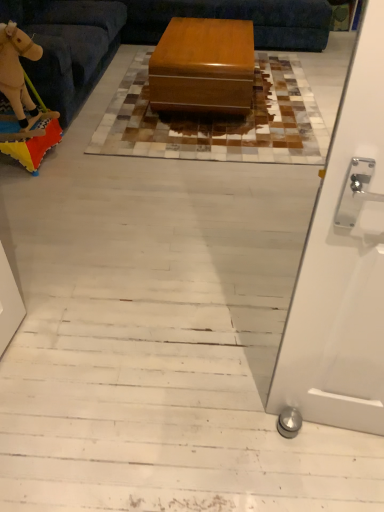
Question: Is velvety beige rocking horse at left to the right of wooden toy horse at left from the viewer's perspective?

Choices:
 (A) yes
 (B) no

Answer: (A)

Question: Is wooden toy horse at left at the back of velvety beige rocking horse at left?

Choices:
 (A) no
 (B) yes

Answer: (A)

Question: Does velvety beige rocking horse at left appear on the left side of wooden toy horse at left?

Choices:
 (A) yes
 (B) no

Answer: (B)

Question: Is velvety beige rocking horse at left thinner than wooden toy horse at left?

Choices:
 (A) yes
 (B) no

Answer: (A)

Question: Considering the relative sizes of velvety beige rocking horse at left and wooden toy horse at left in the image provided, is velvety beige rocking horse at left taller than wooden toy horse at left?

Choices:
 (A) no
 (B) yes

Answer: (A)

Question: Can you confirm if velvety beige rocking horse at left is shorter than wooden toy horse at left?

Choices:
 (A) yes
 (B) no

Answer: (A)

Question: From a real-world perspective, is velvety beige rocking horse at left physically above light brown plush toy at left?

Choices:
 (A) yes
 (B) no

Answer: (A)

Question: Considering the relative positions of velvety beige rocking horse at left and light brown plush toy at left in the image provided, is velvety beige rocking horse at left in front of light brown plush toy at left?

Choices:
 (A) yes
 (B) no

Answer: (A)

Question: Considering the relative sizes of velvety beige rocking horse at left and light brown plush toy at left in the image provided, is velvety beige rocking horse at left shorter than light brown plush toy at left?

Choices:
 (A) no
 (B) yes

Answer: (A)

Question: Is velvety beige rocking horse at left oriented away from light brown plush toy at left?

Choices:
 (A) yes
 (B) no

Answer: (B)

Question: From the image's perspective, does velvety beige rocking horse at left appear higher than light brown plush toy at left?

Choices:
 (A) no
 (B) yes

Answer: (A)

Question: Is the depth of velvety beige rocking horse at left greater than that of light brown plush toy at left?

Choices:
 (A) yes
 (B) no

Answer: (B)

Question: Is wooden toy horse at left behind glossy wood table at center?

Choices:
 (A) yes
 (B) no

Answer: (B)